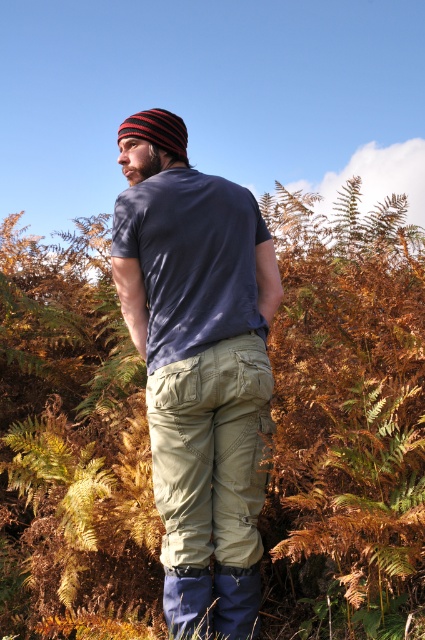
Question: Among these points, which one is farthest from the camera?

Choices:
 (A) (311, 209)
 (B) (235, 509)

Answer: (A)

Question: Is the position of brown dry leaves at center more distant than that of matte blue t-shirt at center?

Choices:
 (A) no
 (B) yes

Answer: (B)

Question: Observing the image, what is the correct spatial positioning of brown dry leaves at center in reference to matte blue t-shirt at center?

Choices:
 (A) right
 (B) left

Answer: (B)

Question: Is brown dry leaves at center positioned in front of matte blue t-shirt at center?

Choices:
 (A) no
 (B) yes

Answer: (A)